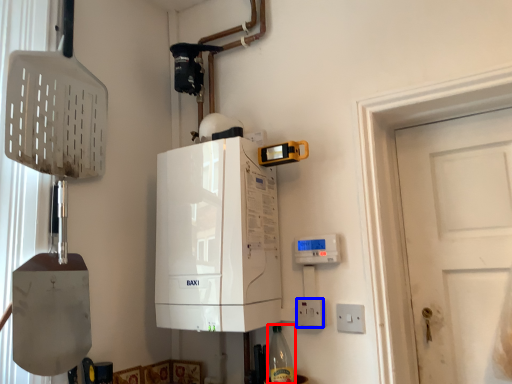
Question: Among these objects, which one is farthest to the camera, bottle (highlighted by a red box) or electric outlet (highlighted by a blue box)?

Choices:
 (A) bottle
 (B) electric outlet

Answer: (B)